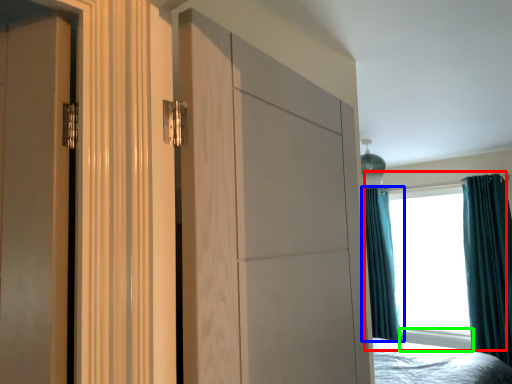
Question: Estimate the real-world distances between objects in this image. Which object is closer to window (highlighted by a red box), curtain (highlighted by a blue box) or radiator (highlighted by a green box)?

Choices:
 (A) curtain
 (B) radiator

Answer: (A)